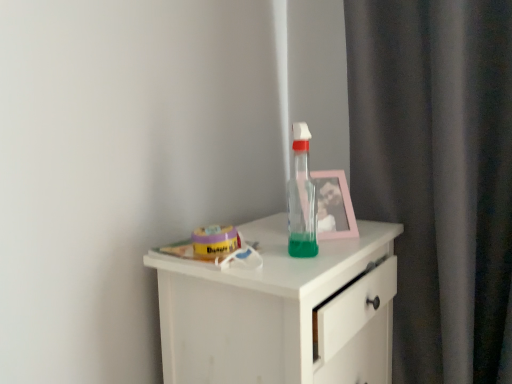
Image resolution: width=512 pixels, height=384 pixels. What do you see at coordinates (282, 312) in the screenshot? I see `white matte chest of drawers at center` at bounding box center [282, 312].

Locate an element on the screen. transparent plastic bottle at center is located at coordinates (301, 199).

Describe the element at coordinates (333, 205) in the screenshot. This screenshot has width=512, height=384. I see `pink plastic picture frame at upper right` at that location.

You are a GUI agent. You are given a task and a screenshot of the screen. Output one action in this format:
    pyautogui.click(x=<x>, y=<y>)
    Task: Click on the pink plastic picture frame at upper right
    Image resolution: width=512 pixels, height=384 pixels.
    Given the screenshot: What is the action you would take?
    pyautogui.click(x=333, y=205)

This screenshot has width=512, height=384. Identify the location of white matte chest of drawers at center. (282, 312).

Is white matte chest of drawers at center touching pink plastic picture frame at upper right?

white matte chest of drawers at center and pink plastic picture frame at upper right are not in contact.

You are a GUI agent. You are given a task and a screenshot of the screen. Output one action in this format:
    pyautogui.click(x=<x>, y=<y>)
    Task: Click on the chest of drawers in front of the pink plastic picture frame at upper right
    The height and width of the screenshot is (384, 512).
    Given the screenshot: What is the action you would take?
    [x=282, y=312]

From a real-world perspective, which object rests below the other?

From a 3D spatial view, white matte chest of drawers at center is below.

From the image's perspective, which one is positioned higher, white matte chest of drawers at center or pink plastic picture frame at upper right?

pink plastic picture frame at upper right is shown above in the image.

Considering the positions of objects white matte chest of drawers at center and transparent plastic bottle at center in the image provided, who is more to the right, white matte chest of drawers at center or transparent plastic bottle at center?

transparent plastic bottle at center is more to the right.

Locate an element on the screen. the chest of drawers that appears below the transparent plastic bottle at center (from the image's perspective) is located at coordinates (282, 312).

From a real-world perspective, is white matte chest of drawers at center over transparent plastic bottle at center?

No.

Is transparent plastic bottle at center looking in the opposite direction of white matte chest of drawers at center?

transparent plastic bottle at center does not have its back to white matte chest of drawers at center.

How different are the orientations of transparent plastic bottle at center and white matte chest of drawers at center in degrees?

They differ by 7.24 degrees in their facing directions.

From the image's perspective, which is below, transparent plastic bottle at center or white matte chest of drawers at center?

white matte chest of drawers at center appears lower in the image.

In the scene shown: Can you confirm if pink plastic picture frame at upper right is smaller than transparent plastic bottle at center?

Actually, pink plastic picture frame at upper right might be larger than transparent plastic bottle at center.

Between pink plastic picture frame at upper right and transparent plastic bottle at center, which one has more height?

transparent plastic bottle at center is taller.

Considering the relative positions of pink plastic picture frame at upper right and transparent plastic bottle at center in the image provided, is pink plastic picture frame at upper right to the left of transparent plastic bottle at center from the viewer's perspective?

In fact, pink plastic picture frame at upper right is to the right of transparent plastic bottle at center.

Considering the positions of objects pink plastic picture frame at upper right and transparent plastic bottle at center in the image provided, who is in front, pink plastic picture frame at upper right or transparent plastic bottle at center?

transparent plastic bottle at center.

Considering the sizes of objects pink plastic picture frame at upper right and white matte chest of drawers at center in the image provided, who is shorter, pink plastic picture frame at upper right or white matte chest of drawers at center?

With less height is pink plastic picture frame at upper right.

Looking at this image, from a real-world perspective, which object stands above the other?

In real-world perspective, pink plastic picture frame at upper right is above.

Could you tell me if pink plastic picture frame at upper right is facing white matte chest of drawers at center?

No, pink plastic picture frame at upper right is not oriented towards white matte chest of drawers at center.

Considering the positions of objects pink plastic picture frame at upper right and white matte chest of drawers at center in the image provided, who is more to the right, pink plastic picture frame at upper right or white matte chest of drawers at center?

Positioned to the right is pink plastic picture frame at upper right.

Which of these two, transparent plastic bottle at center or pink plastic picture frame at upper right, is thinner?

With smaller width is transparent plastic bottle at center.

Considering the sizes of transparent plastic bottle at center and pink plastic picture frame at upper right in the image, is transparent plastic bottle at center bigger or smaller than pink plastic picture frame at upper right?

transparent plastic bottle at center is smaller than pink plastic picture frame at upper right.

Is pink plastic picture frame at upper right a part of transparent plastic bottle at center?

Actually, pink plastic picture frame at upper right is outside transparent plastic bottle at center.

You are a GUI agent. You are given a task and a screenshot of the screen. Output one action in this format:
    pyautogui.click(x=<x>, y=<y>)
    Task: Click on the bottle on the left of pink plastic picture frame at upper right
    The height and width of the screenshot is (384, 512).
    Given the screenshot: What is the action you would take?
    pyautogui.click(x=301, y=199)

Identify the location of chest of drawers below the pink plastic picture frame at upper right (from a real-world perspective). (282, 312).

Image resolution: width=512 pixels, height=384 pixels. In order to click on chest of drawers on the left of transparent plastic bottle at center in this screenshot , I will do `click(282, 312)`.

From the image, which object appears to be nearer to white matte chest of drawers at center, pink plastic picture frame at upper right or transparent plastic bottle at center?

Based on the image, transparent plastic bottle at center appears to be nearer to white matte chest of drawers at center.

Estimate the real-world distances between objects in this image. Which object is further from pink plastic picture frame at upper right, transparent plastic bottle at center or white matte chest of drawers at center?

The object further to pink plastic picture frame at upper right is white matte chest of drawers at center.

Looking at the image, which one is located further to white matte chest of drawers at center, transparent plastic bottle at center or pink plastic picture frame at upper right?

The object further to white matte chest of drawers at center is pink plastic picture frame at upper right.

Considering their positions, is pink plastic picture frame at upper right positioned further to transparent plastic bottle at center than white matte chest of drawers at center?

Among the two, white matte chest of drawers at center is located further to transparent plastic bottle at center.

Looking at the image, which one is located closer to pink plastic picture frame at upper right, white matte chest of drawers at center or transparent plastic bottle at center?

transparent plastic bottle at center is closer to pink plastic picture frame at upper right.

Estimate the real-world distances between objects in this image. Which object is closer to transparent plastic bottle at center, white matte chest of drawers at center or pink plastic picture frame at upper right?

pink plastic picture frame at upper right lies closer to transparent plastic bottle at center than the other object.

Image resolution: width=512 pixels, height=384 pixels. Identify the location of picture frame between transparent plastic bottle at center and white matte chest of drawers at center from top to bottom. (333, 205).